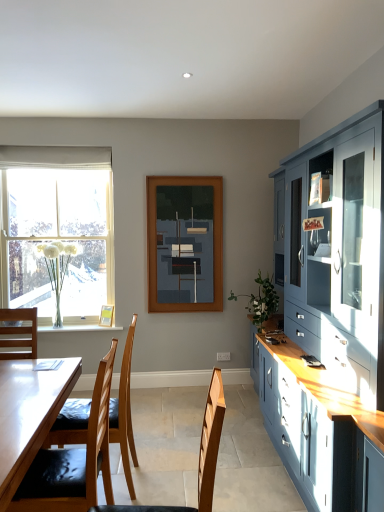
Question: From their relative heights in the image, would you say clear glass vase at lower left is taller or shorter than matte yellow picture frame at window?

Choices:
 (A) tall
 (B) short

Answer: (B)

Question: Based on their sizes in the image, would you say clear glass vase at lower left is bigger or smaller than matte yellow picture frame at window?

Choices:
 (A) small
 (B) big

Answer: (B)

Question: Based on their relative distances, which object is farther from the wooden chair at center, which is counted as the third chair, starting from the back?

Choices:
 (A) wooden chair at left, acting as the 2th chair starting from the front
 (B) matte wooden frame at center
 (C) matte blue cabinet at right
 (D) white glass vase at left, the first plant in the back-to-front sequence
 (E) white sheer curtain at upper left

Answer: (E)

Question: Which object is the closest to the white sheer curtain at upper left?

Choices:
 (A) clear glass vase at lower left
 (B) wooden chair at center, which is counted as the third chair, starting from the back
 (C) green leafy plant at right, the 1th plant positioned from the right
 (D) white glass vase at left, which is the 1th plant from left to right
 (E) matte yellow picture frame at window

Answer: (D)